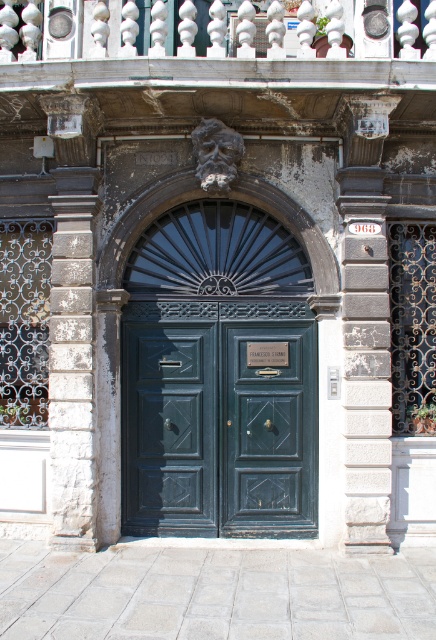
You are standing at the point marked as point (248, 400) and want to reach the other side of the building. The minimum distance you need to walk is 7.45 meters. Is this distance sufficient to reach the other side?

Yes, the minimum distance required to reach the other side is exactly 7.45 meters, so walking that distance will suffice.

You are a maintenance worker needing to replace a section of railing. You have a 2.5 meter long replacement piece. Can you safely install it between the white marble railing at upper center and the white stone column at left without cutting it down?

The distance between the white marble railing at upper center and the white stone column at left is 2.22 meters. Since the replacement piece is 2.5 meters long, it is longer than the required space. Therefore, you would need to cut it down to fit the 2.22 meter gap between them.